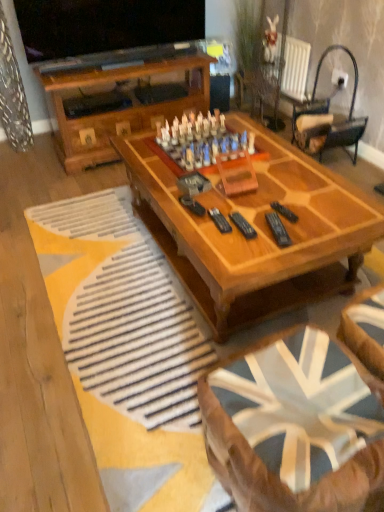
You are a GUI agent. You are given a task and a screenshot of the screen. Output one action in this format:
    pyautogui.click(x=<x>, y=<y>)
    Task: Click on the free space to the right of black plastic remote at center, positioned as the first remote in right-to-left order
    The height and width of the screenshot is (512, 384).
    Given the screenshot: What is the action you would take?
    pyautogui.click(x=320, y=211)